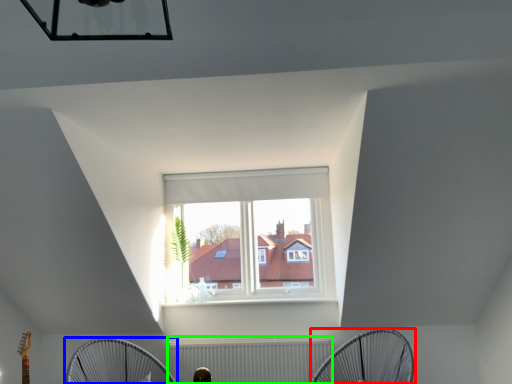
Question: Considering the real-world distances, which object is closest to mechanical fan (highlighted by a red box)? mechanical fan (highlighted by a blue box) or radiator (highlighted by a green box).

Choices:
 (A) mechanical fan
 (B) radiator

Answer: (B)